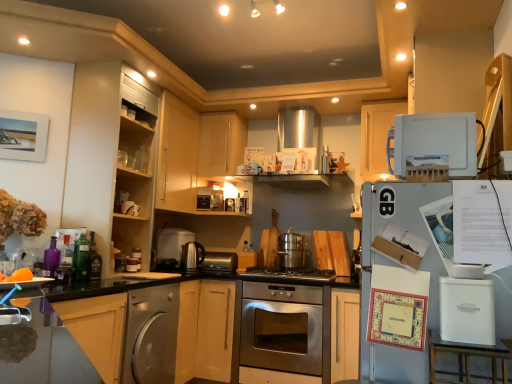
Question: From the image's perspective, does satin nickel kettle at center, acting as the fourth appliance starting from the right, appear lower than stainless steel gas stove at center?

Choices:
 (A) yes
 (B) no

Answer: (B)

Question: Is satin nickel kettle at center, which is counted as the fourth appliance, starting from the top, in contact with stainless steel gas stove at center?

Choices:
 (A) yes
 (B) no

Answer: (B)

Question: Can you confirm if satin nickel kettle at center, which is counted as the fourth appliance, starting from the top, is taller than stainless steel gas stove at center?

Choices:
 (A) yes
 (B) no

Answer: (A)

Question: Is satin nickel kettle at center, the 2th appliance from the left, thinner than stainless steel gas stove at center?

Choices:
 (A) yes
 (B) no

Answer: (A)

Question: Can you confirm if satin nickel kettle at center, the 2th appliance from the left, is shorter than stainless steel gas stove at center?

Choices:
 (A) yes
 (B) no

Answer: (B)

Question: Is satin nickel kettle at center, acting as the fourth appliance starting from the right, facing away from stainless steel gas stove at center?

Choices:
 (A) yes
 (B) no

Answer: (B)

Question: Can you confirm if green glass bottle at left, arranged as the fourth bottle when viewed from the front, is bigger than satin silver dishwasher at lower left?

Choices:
 (A) no
 (B) yes

Answer: (A)

Question: Does green glass bottle at left, placed as the fourth bottle when sorted from left to right, have a lesser width compared to satin silver dishwasher at lower left?

Choices:
 (A) no
 (B) yes

Answer: (B)

Question: From the image's perspective, does green glass bottle at left, arranged as the fourth bottle when viewed from the front, appear higher than satin silver dishwasher at lower left?

Choices:
 (A) no
 (B) yes

Answer: (B)

Question: From a real-world perspective, is green glass bottle at left, arranged as the fourth bottle when viewed from the front, beneath satin silver dishwasher at lower left?

Choices:
 (A) no
 (B) yes

Answer: (A)

Question: Considering the relative sizes of green glass bottle at left, arranged as the fourth bottle when viewed from the front, and satin silver dishwasher at lower left in the image provided, is green glass bottle at left, arranged as the fourth bottle when viewed from the front, wider than satin silver dishwasher at lower left?

Choices:
 (A) yes
 (B) no

Answer: (B)

Question: Is green glass bottle at left, which is the 2th bottle from back to front, positioned with its back to satin silver dishwasher at lower left?

Choices:
 (A) no
 (B) yes

Answer: (A)

Question: From the image's perspective, would you say stainless steel oven at center is shown under white matte cabinet at upper right, positioned as the 3th cabinetry in left-to-right order?

Choices:
 (A) no
 (B) yes

Answer: (B)